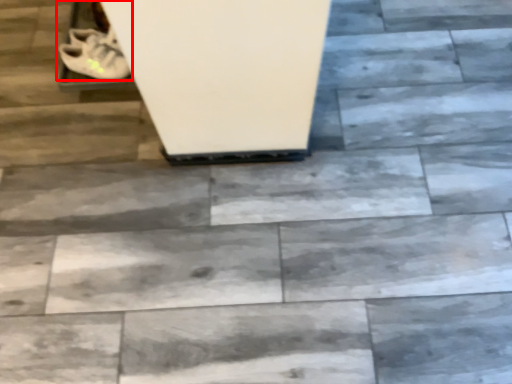
Question: From the image's perspective, considering the relative positions of footwear (annotated by the red box) and shoe in the image provided, where is footwear (annotated by the red box) located with respect to the staircase?

Choices:
 (A) above
 (B) below

Answer: (A)